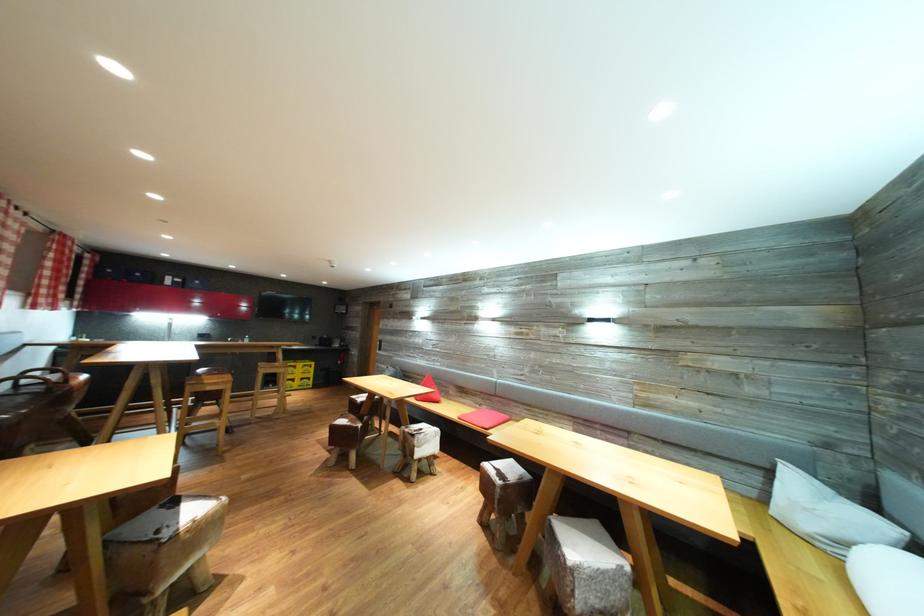
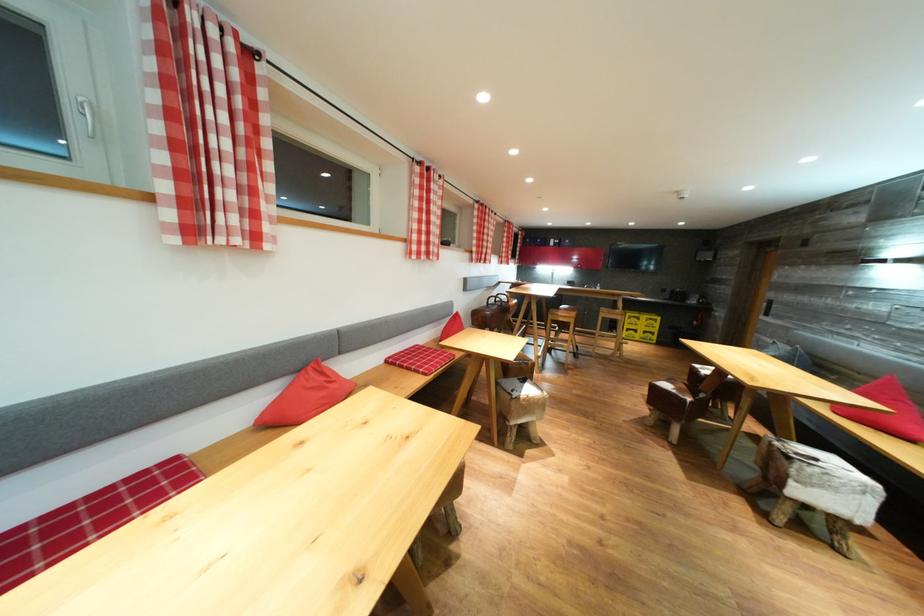
The point at (200, 517) is marked in the first image. Where is the corresponding point in the second image?

(536, 395)